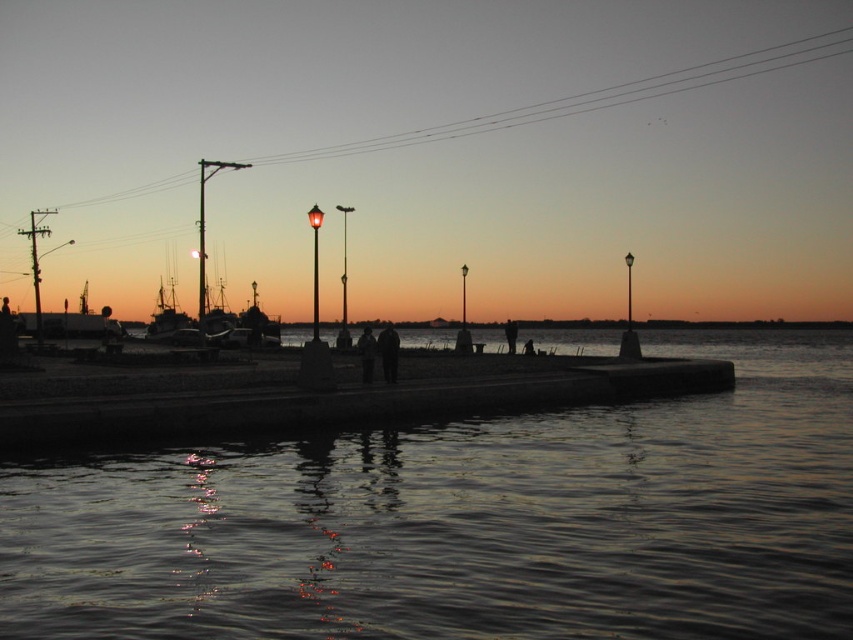
You are standing on the pier and see both the dark reflective water at center and the dark blue jeans at center. Which object is positioned to the right of the other?

The dark reflective water at center is to the right of the dark blue jeans at center.

You are standing on the pier and looking down at the dark reflective water at center and the dark blue jeans at center. Which object is closer to you?

The dark reflective water at center is closer to the viewer than the dark blue jeans at center.

You are standing on the waterfront and want to determine the relative positions of two points in the scene. Which point, point (560, 538) or point (370, 353), is closer to you?

Point (560, 538) is closer to the viewer than point (370, 353).